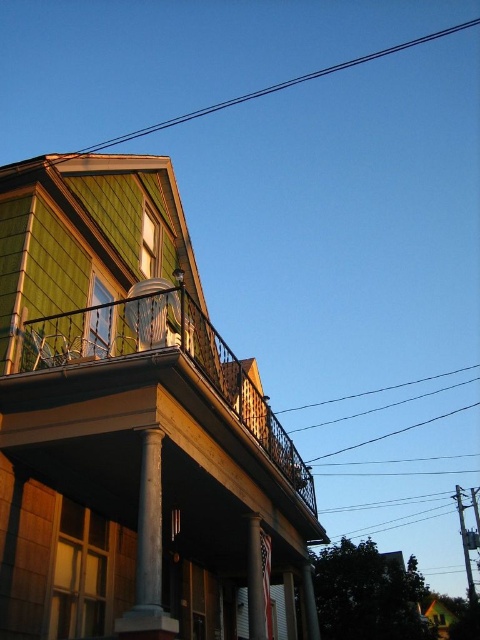
You are a painter hired to restore the balcony of the house. You need to determine which material to use for the railing. The wooden railing at upper center and the black wire at upper center are both options. Based on their thickness, which one would require less material to produce?

The wooden railing at upper center is thinner than the black wire at upper center, so the wooden railing at upper center would require less material to produce.

You are a surveyor measuring distances between architectural elements. You need to determine if the distance between the white marble column at center and the black wire at upper center is more than 25 meters. Based on the scene, what is your conclusion?

The white marble column at center is 26.13 meters away from the black wire at upper center, so the distance is more than 25 meters.

Consider the image. Based on the scene description, which object is positioned to the left when observing the house from the front? The white marble column at center or the white marble pillar at center?

The white marble column at center is positioned to the left of the white marble pillar at center.